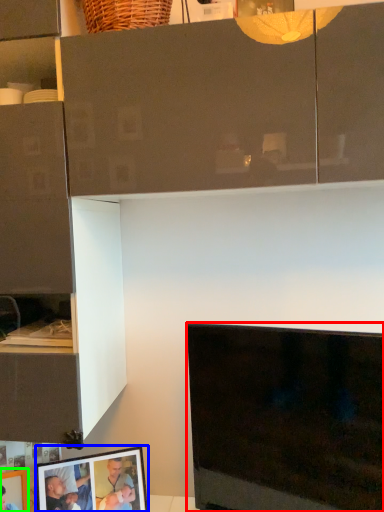
Question: Which is farther away from television (highlighted by a red box)? picture frame (highlighted by a blue box) or picture frame (highlighted by a green box)?

Choices:
 (A) picture frame
 (B) picture frame

Answer: (B)